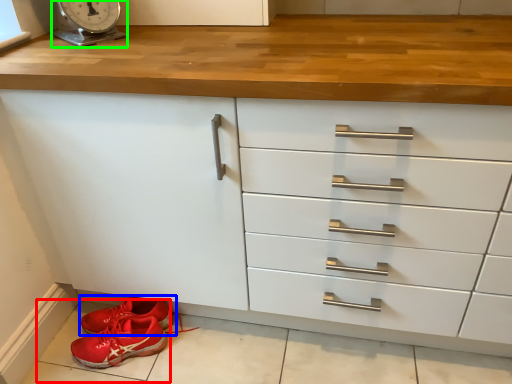
Question: Which object is positioned farthest from tile (highlighted by a red box)? Select from footwear (highlighted by a blue box) and scale (highlighted by a green box).

Choices:
 (A) footwear
 (B) scale

Answer: (B)